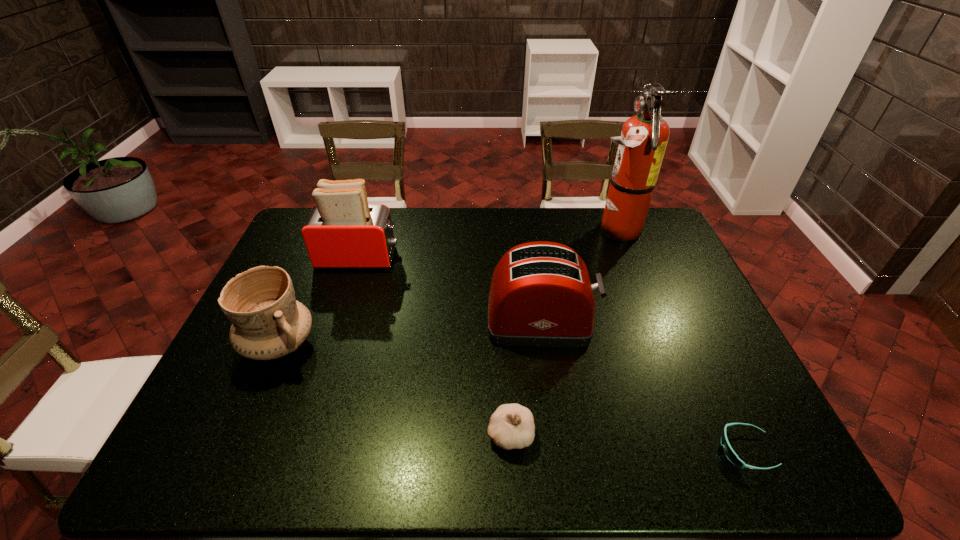
Identify the location of garlic that is at the near edge. The height and width of the screenshot is (540, 960). (511, 426).

Locate an element on the screen. The height and width of the screenshot is (540, 960). sunglasses at the near edge is located at coordinates (729, 452).

You are a GUI agent. You are given a task and a screenshot of the screen. Output one action in this format:
    pyautogui.click(x=<x>, y=<y>)
    Task: Click on the toaster present at the left edge
    
    Given the screenshot: What is the action you would take?
    pyautogui.click(x=342, y=231)

In order to click on pottery present at the left edge in this screenshot , I will do `click(268, 323)`.

At what (x,y) coordinates should I click in order to perform the action: click on fire extinguisher situated at the right edge. Please return your answer as a coordinate pair (x, y). This screenshot has height=540, width=960. Looking at the image, I should click on (644, 137).

This screenshot has width=960, height=540. In order to click on sunglasses present at the right edge in this screenshot , I will do `click(729, 452)`.

I want to click on object located at the far left corner, so click(342, 231).

Where is `object that is at the far right corner`? The image size is (960, 540). object that is at the far right corner is located at coordinates (644, 137).

You are a GUI agent. You are given a task and a screenshot of the screen. Output one action in this format:
    pyautogui.click(x=<x>, y=<y>)
    Task: Click on the object present at the near right corner
    
    Given the screenshot: What is the action you would take?
    pyautogui.click(x=729, y=452)

Where is `vacant space at the far edge of the desktop`? vacant space at the far edge of the desktop is located at coordinates (403, 232).